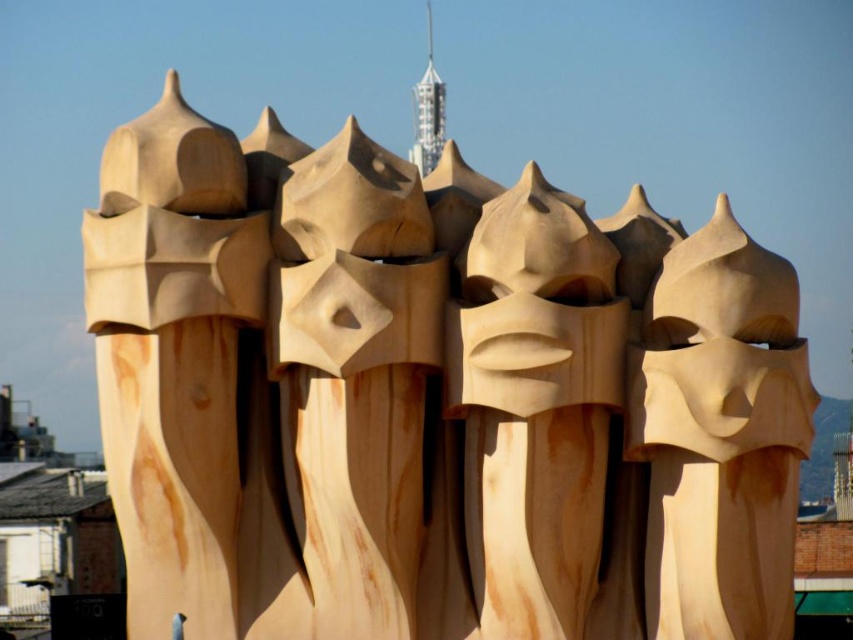
Question: Based on their relative distances, which object is nearer to the natural wood mask at center?

Choices:
 (A) natural wood sculpture at upper left
 (B) natural wood sculpture at center

Answer: (B)

Question: Is natural wood sculpture at upper left to the right of natural wood sculpture at center from the viewer's perspective?

Choices:
 (A) no
 (B) yes

Answer: (A)

Question: Can you confirm if natural wood sculpture at upper left is positioned below natural wood mask at center?

Choices:
 (A) yes
 (B) no

Answer: (A)

Question: Can you confirm if natural wood sculpture at upper left is positioned to the left of natural wood sculpture at center?

Choices:
 (A) no
 (B) yes

Answer: (B)

Question: Which of these objects is positioned farthest from the natural wood sculpture at upper left?

Choices:
 (A) natural wood sculpture at center
 (B) natural wood mask at center

Answer: (A)

Question: Which of the following is the farthest from the observer?

Choices:
 (A) (184, 378)
 (B) (677, 477)
 (C) (584, 509)

Answer: (C)